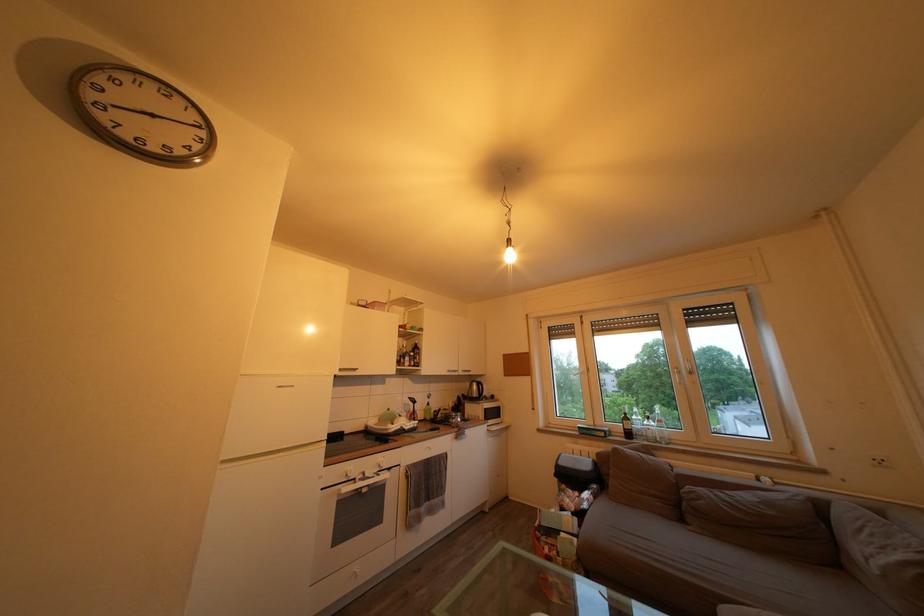
The image size is (924, 616). Identify the location of oven door handle. (363, 483).